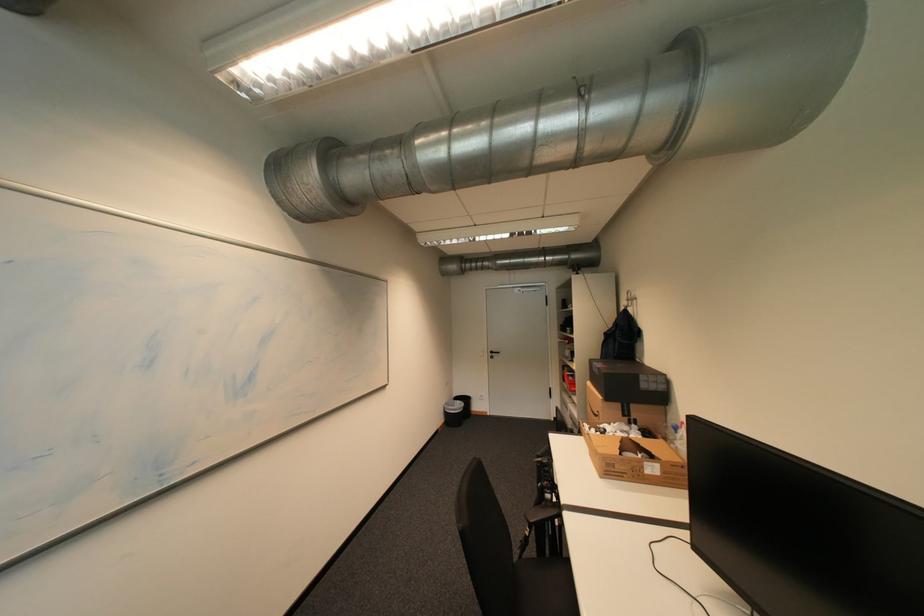
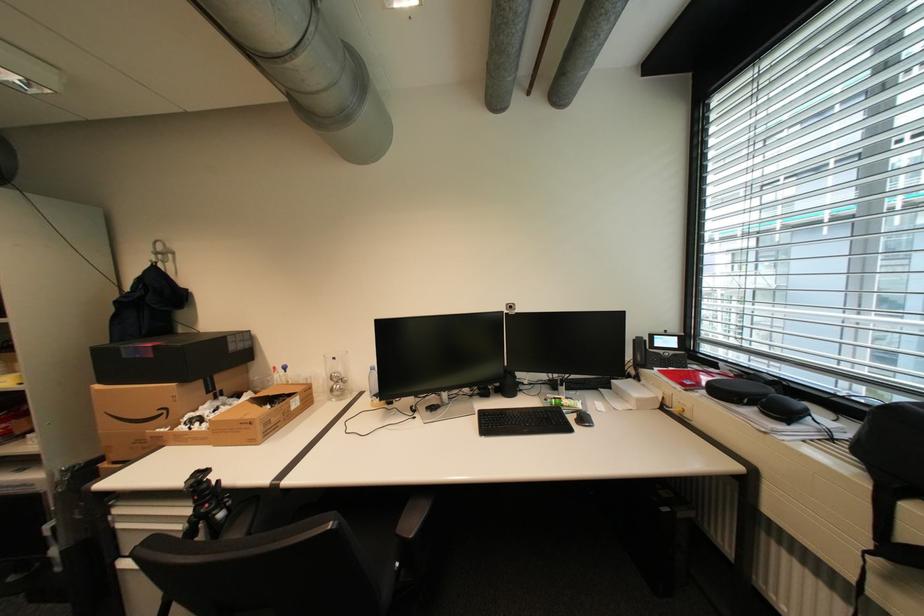
Question: The first image is from the beginning of the video and the second image is from the end. How did the camera likely rotate when shooting the video?

Choices:
 (A) Left
 (B) Right
 (C) Up
 (D) Down

Answer: (B)